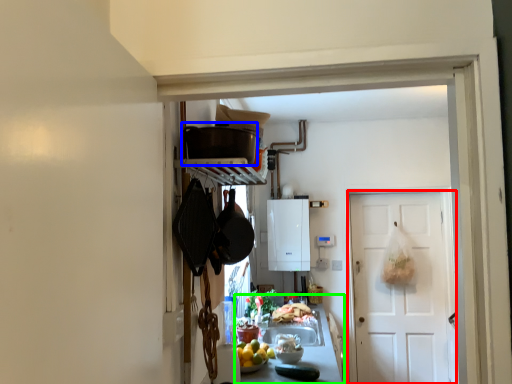
Question: Which object is positioned closest to door (highlighted by a red box)? Select from appliance (highlighted by a blue box) and counter top (highlighted by a green box).

Choices:
 (A) appliance
 (B) counter top

Answer: (B)